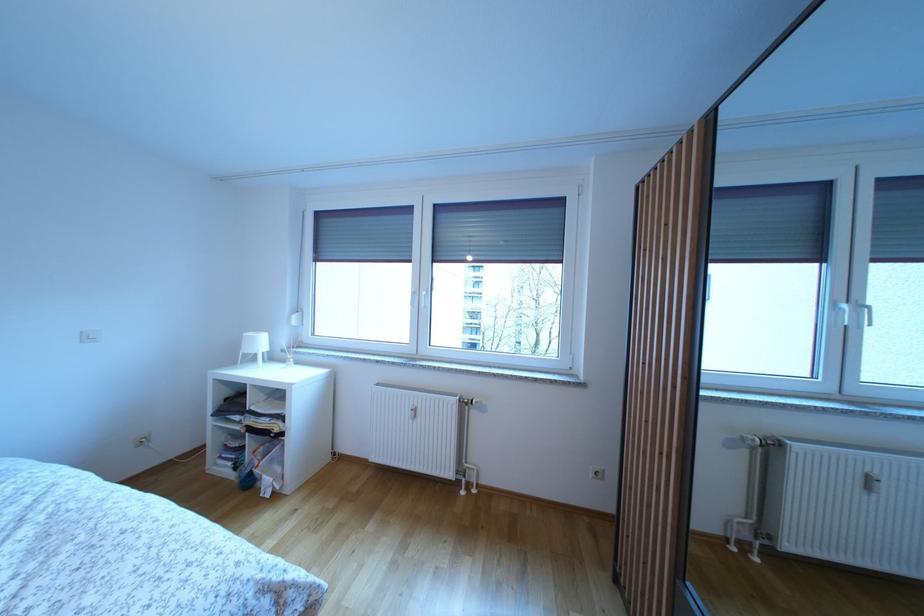
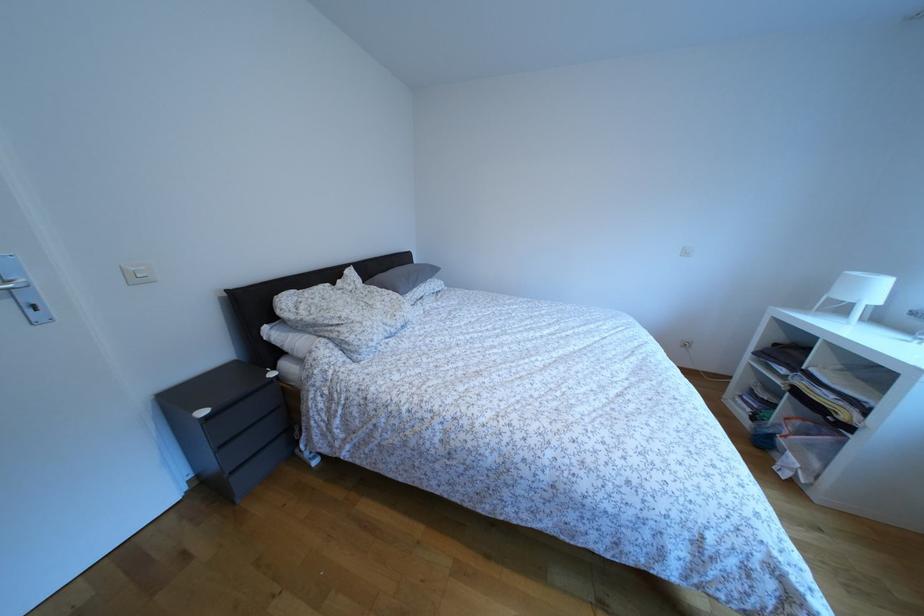
Based on the continuous images, in which direction is the camera rotating?

The camera rotated toward left-down.